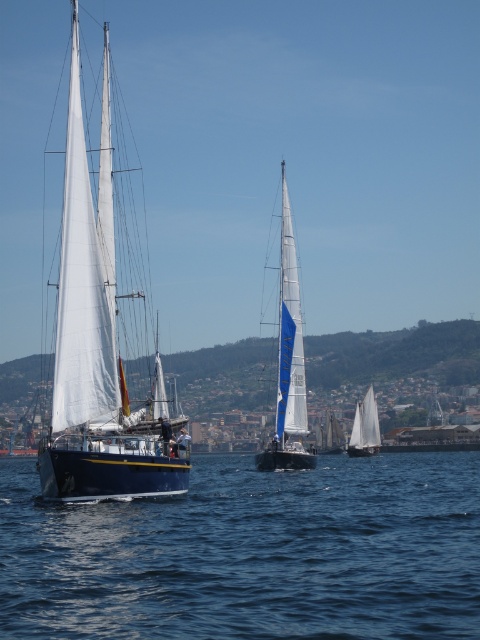
Does blue water at lower left appear on the left side of white matte sailboat at center?

Yes, blue water at lower left is to the left of white matte sailboat at center.

Looking at this image, who is taller, blue water at lower left or white matte sailboat at center?

With more height is white matte sailboat at center.

Which is in front, point (244, 618) or point (288, 412)?

Point (244, 618) is more forward.

Where is `blue water at lower left`? Image resolution: width=480 pixels, height=640 pixels. blue water at lower left is located at coordinates (251, 554).

How much distance is there between white matte sailboat at left and white sailboat at center?

The distance of white matte sailboat at left from white sailboat at center is 78.80 meters.

Is white matte sailboat at left taller than white sailboat at center?

Indeed, white matte sailboat at left has a greater height compared to white sailboat at center.

Who is more distant from viewer, (83, 236) or (361, 424)?

Positioned behind is point (361, 424).

Find the location of a particular element. white matte sailboat at left is located at coordinates (95, 340).

Between point (63, 492) and point (280, 230), which one is positioned in front?

Point (63, 492) is in front.

Who is positioned more to the right, white matte sailboat at left or white matte sailboat at center?

From the viewer's perspective, white matte sailboat at center appears more on the right side.

The height and width of the screenshot is (640, 480). What do you see at coordinates (95, 340) in the screenshot?
I see `white matte sailboat at left` at bounding box center [95, 340].

Find the location of `white matte sailboat at left`. white matte sailboat at left is located at coordinates click(95, 340).